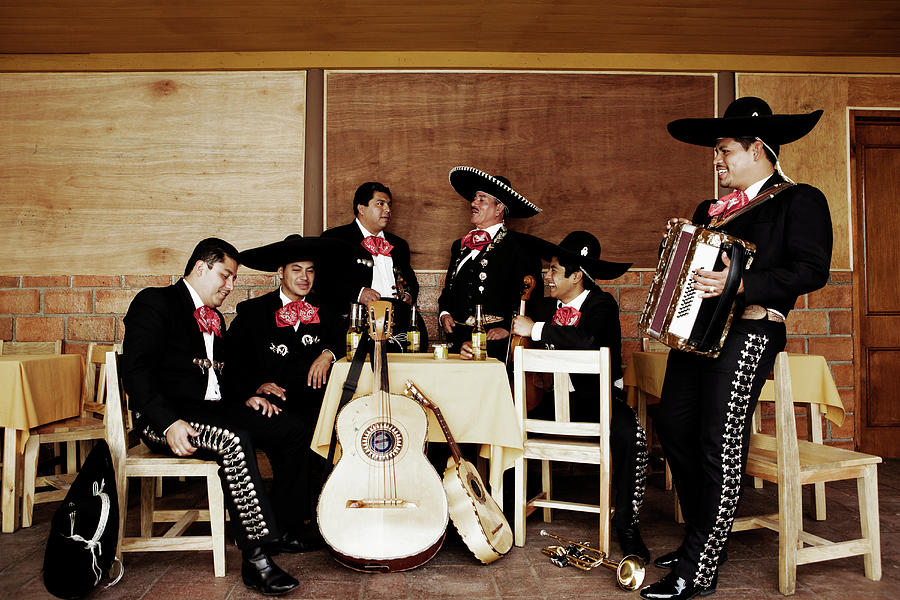
You are a GUI agent. You are given a task and a screenshot of the screen. Output one action in this format:
    pyautogui.click(x=<x>, y=<y>)
    Task: Click on the table
    
    Given the screenshot: What is the action you would take?
    pyautogui.click(x=472, y=406)